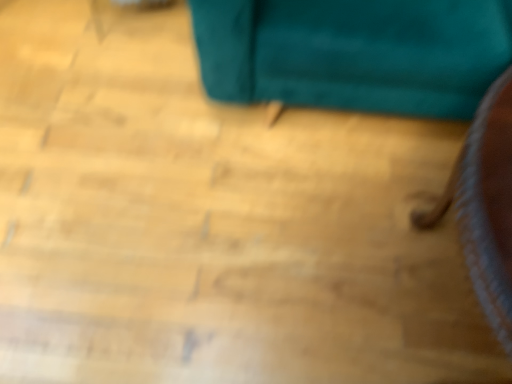
What do you see at coordinates (355, 52) in the screenshot?
I see `teal velvet sofa at upper right` at bounding box center [355, 52].

What is the approximate width of teal velvet sofa at upper right?

The width of teal velvet sofa at upper right is 33.75 inches.

Find the location of a particular element. This screenshot has height=384, width=512. teal velvet sofa at upper right is located at coordinates (355, 52).

Identify the location of teal velvet sofa at upper right. Image resolution: width=512 pixels, height=384 pixels. (355, 52).